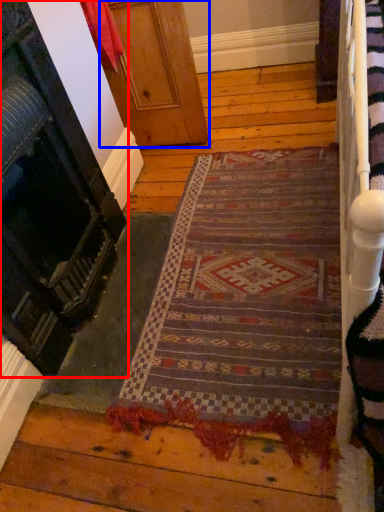
Question: Which object is closer to the camera taking this photo, door (highlighted by a red box) or door (highlighted by a blue box)?

Choices:
 (A) door
 (B) door

Answer: (A)